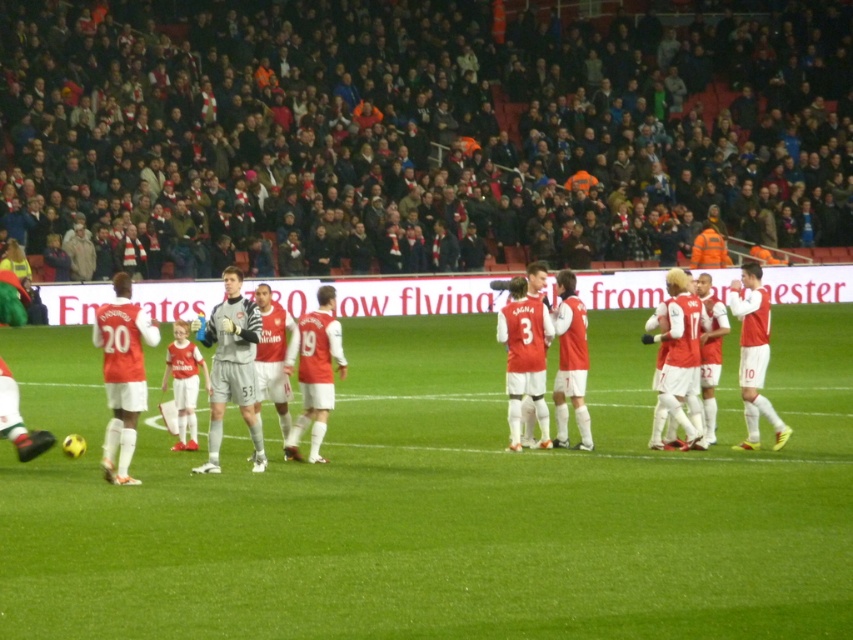
Question: Does dark gray fabric crowd at upper center come in front of gray/white jersey at center?

Choices:
 (A) no
 (B) yes

Answer: (A)

Question: Estimate the real-world distances between objects in this image. Which object is closer to the dark gray fabric crowd at upper center?

Choices:
 (A) green grass football field at center
 (B) gray/white jersey at center
 (C) matte red jersey at right

Answer: (A)

Question: Does green grass football field at center appear on the right side of matte red jersey at right?

Choices:
 (A) no
 (B) yes

Answer: (A)

Question: Which is farther from the dark gray fabric crowd at upper center?

Choices:
 (A) matte red jersey at right
 (B) green grass football field at center
 (C) gray/white jersey at center

Answer: (A)

Question: Which point is closer to the camera taking this photo?

Choices:
 (A) (462, 602)
 (B) (225, 348)
 (C) (560, 49)
 (D) (769, 417)

Answer: (A)

Question: Does dark gray fabric crowd at upper center have a greater width compared to green grass football field at center?

Choices:
 (A) no
 (B) yes

Answer: (B)